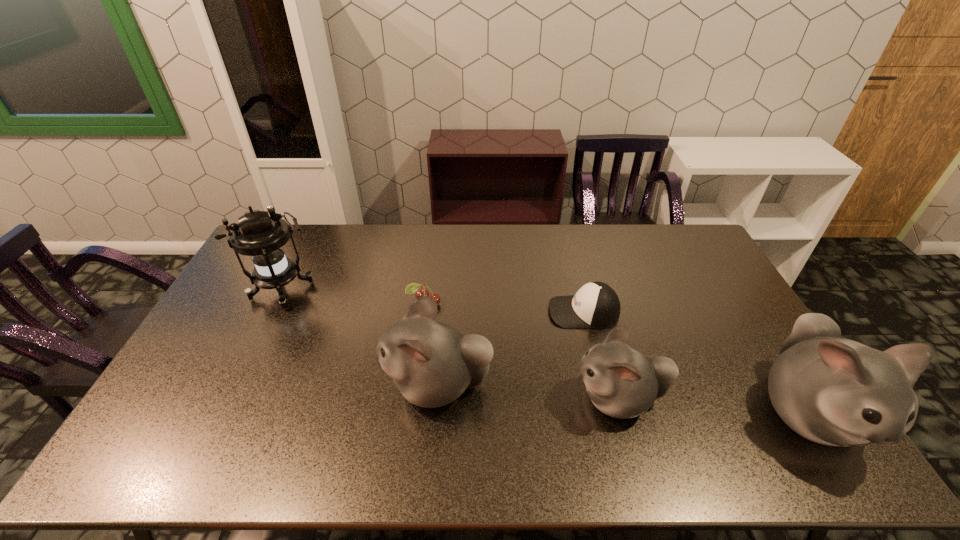
Image resolution: width=960 pixels, height=540 pixels. I want to click on the fourth shortest object, so click(x=432, y=364).

The width and height of the screenshot is (960, 540). Identify the location of the second shortest hamster. (432, 364).

I want to click on the second hamster from left to right, so click(x=622, y=382).

Locate an element on the screen. the third shortest object is located at coordinates (622, 382).

Locate an element on the screen. the rightmost object is located at coordinates (834, 391).

This screenshot has width=960, height=540. What are the coordinates of `cap` in the screenshot? It's located at (596, 305).

At what (x,y) coordinates should I click in order to perform the action: click on the leftmost object. Please return your answer as a coordinate pair (x, y). Image resolution: width=960 pixels, height=540 pixels. Looking at the image, I should click on (262, 237).

Find the location of a particular element. This screenshot has width=960, height=540. the shortest object is located at coordinates (413, 287).

Identify the location of free point located 0.120m on the face of the second tallest hamster. The image size is (960, 540). (340, 385).

You are a GUI agent. You are given a task and a screenshot of the screen. Output one action in this format:
    pyautogui.click(x=<x>, y=<y>)
    Task: Click on the free region located on the face of the second tallest hamster
    The image size is (960, 540).
    Given the screenshot: What is the action you would take?
    pyautogui.click(x=314, y=385)